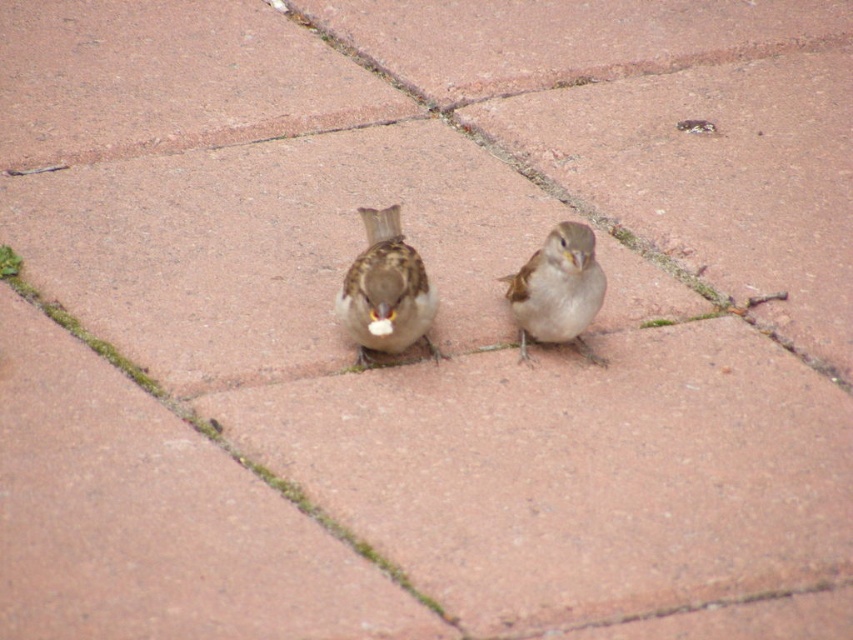
Measure the distance between brown matte sparrow at center and camera.

brown matte sparrow at center and camera are 1.78 meters apart from each other.

Between point (367, 289) and point (521, 356), which one is positioned in front?

Point (367, 289) is more forward.

Does point (357, 284) come farther from viewer compared to point (538, 333)?

No, (357, 284) is in front of (538, 333).

What are the coordinates of `brown matte sparrow at center` in the screenshot? It's located at (386, 291).